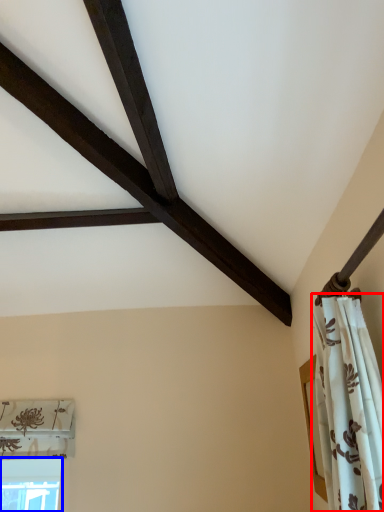
Question: Which object appears closest to the camera in this image, curtain (highlighted by a red box) or window (highlighted by a blue box)?

Choices:
 (A) curtain
 (B) window

Answer: (A)